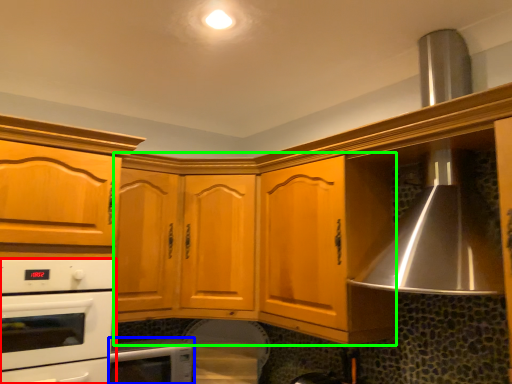
Question: Based on their relative distances, which object is farther from home appliance (highlighted by a red box)? Choose from home appliance (highlighted by a blue box) and cabinetry (highlighted by a green box).

Choices:
 (A) home appliance
 (B) cabinetry

Answer: (B)